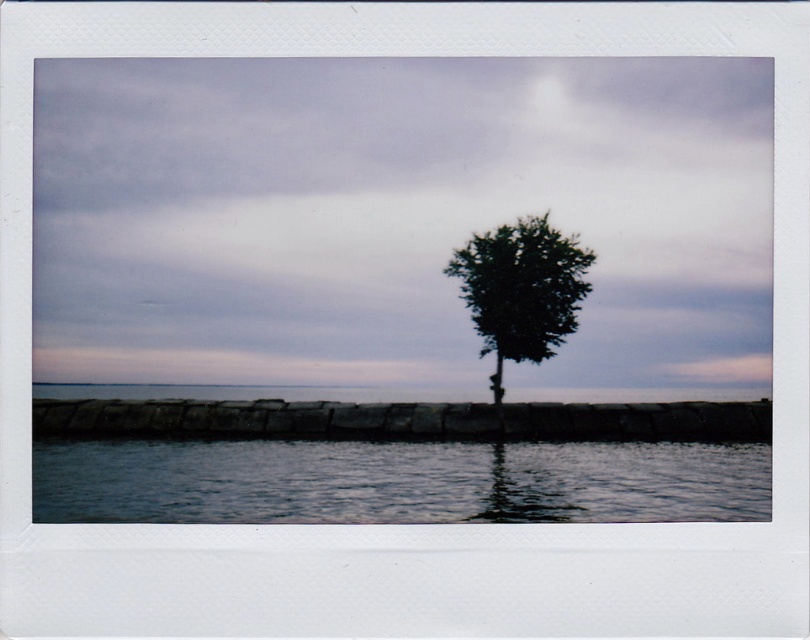
You are a photographer trying to capture the reflection of the dark green leafy tree at center in the clear water at lower center. Based on the scene, is the reflection of the tree likely to be sharp or blurred?

The reflection of the dark green leafy tree at center in the clear water at lower center is likely to be sharp because the water is described as clear and the scene has calm water, which typically allows for clearer reflections.

You are standing on the low stone wall in the foreground. Looking out, you see the clear water at lower center and the dark green leafy tree at center. Which object is closer to you?

The clear water at lower center is closer to you because it is in front of the dark green leafy tree at center.

You are standing on the stone wall in the foreground of the coastal scene. You see the clear water at lower center and the dark green leafy tree at center. Which object is closer to you?

The clear water at lower center is closer to you because it is located below the dark green leafy tree at center, placing it nearer to your position on the stone wall.